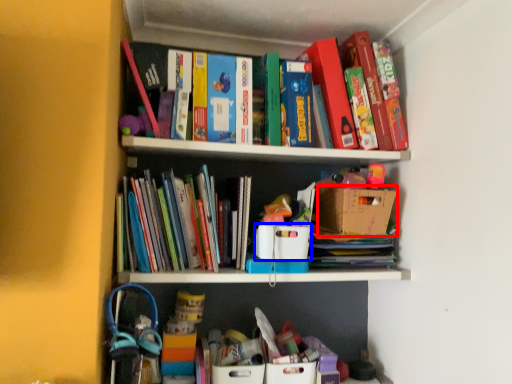
Question: Among these objects, which one is farthest to the camera, cardboard box (highlighted by a red box) or cardboard box (highlighted by a blue box)?

Choices:
 (A) cardboard box
 (B) cardboard box

Answer: (A)